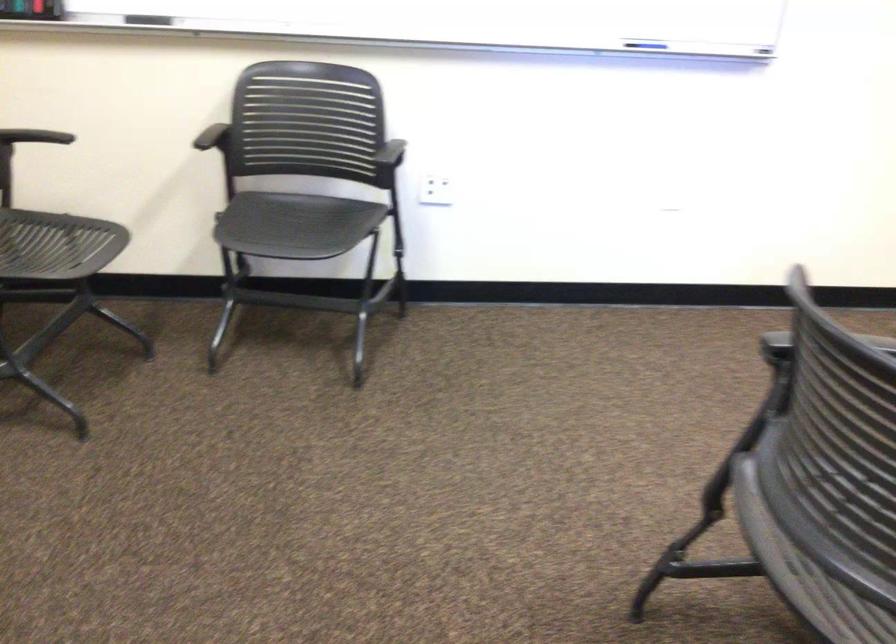
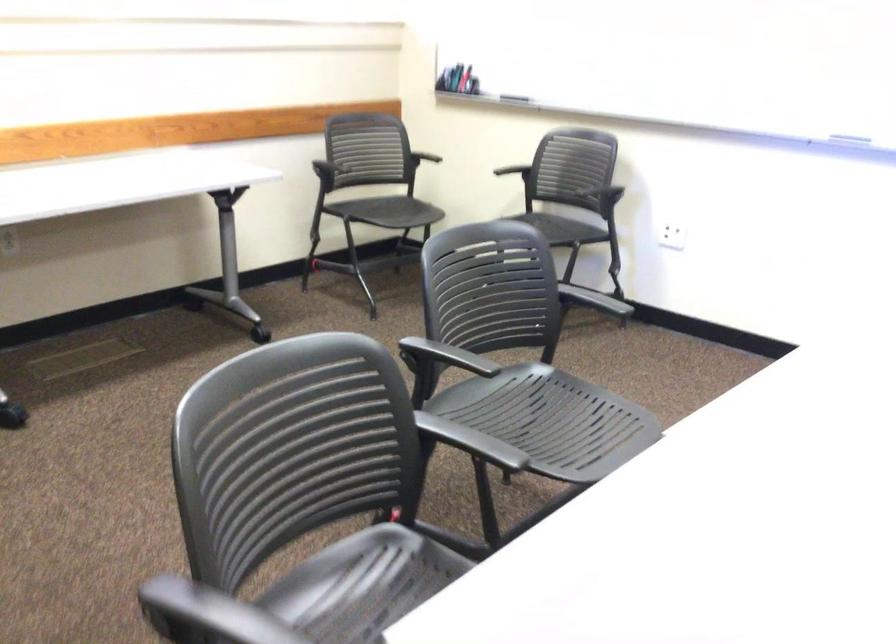
Question: I am providing you with two images of the same scene from different viewpoints. After the viewpoint changes to image2, which objects are now occluded?

Choices:
 (A) whiteboard marker
 (B) chair sitting surface
 (C) black chair armrest
 (D) orange toolbox handle

Answer: (C)